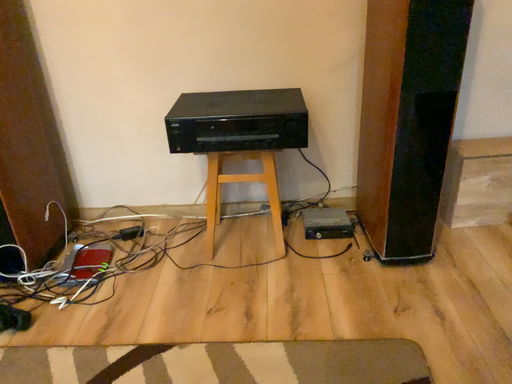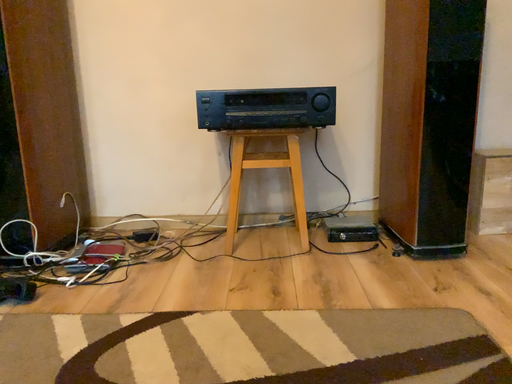
Question: How did the camera likely rotate when shooting the video?

Choices:
 (A) rotated downward
 (B) rotated upward

Answer: (B)